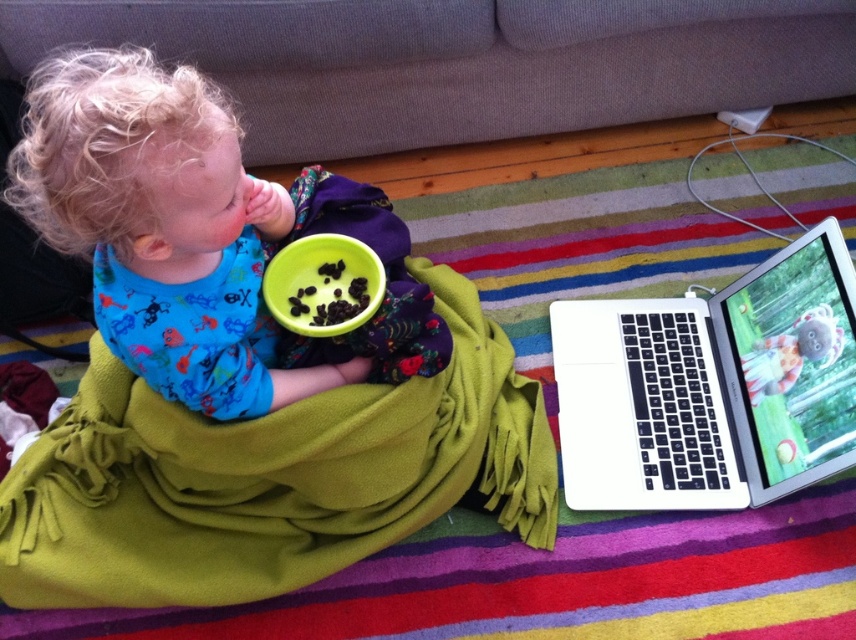
Who is more forward, [461,355] or [669,90]?

Point [461,355] is in front.

Is green fleece blanket at center behind gray fabric couch at upper center?

No, it is not.

The width and height of the screenshot is (856, 640). Identify the location of green fleece blanket at center. (283, 451).

Where is `green fleece blanket at center`? green fleece blanket at center is located at coordinates (283, 451).

Between gray fabric couch at upper center and blue cotton shirt at center, which one is positioned lower?

blue cotton shirt at center

What do you see at coordinates (459, 61) in the screenshot?
I see `gray fabric couch at upper center` at bounding box center [459, 61].

Locate an element on the screen. The height and width of the screenshot is (640, 856). gray fabric couch at upper center is located at coordinates (459, 61).

Image resolution: width=856 pixels, height=640 pixels. I want to click on gray fabric couch at upper center, so click(x=459, y=61).

Is green fleece blanket at center positioned at the back of silver metallic laptop at lower right?

No, green fleece blanket at center is in front of silver metallic laptop at lower right.

Can you confirm if green fleece blanket at center is positioned to the right of silver metallic laptop at lower right?

Incorrect, green fleece blanket at center is not on the right side of silver metallic laptop at lower right.

Is point (304, 458) closer to viewer compared to point (786, 371)?

Yes, point (304, 458) is closer to viewer.

Find the location of a particular element. The height and width of the screenshot is (640, 856). green fleece blanket at center is located at coordinates (283, 451).